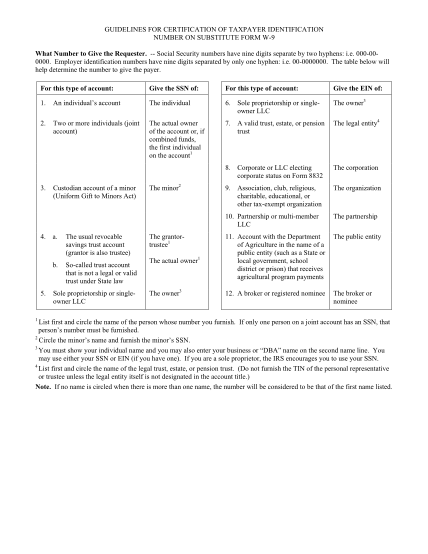
Image resolution: width=428 pixels, height=554 pixels. I want to click on column, so click(x=301, y=150).